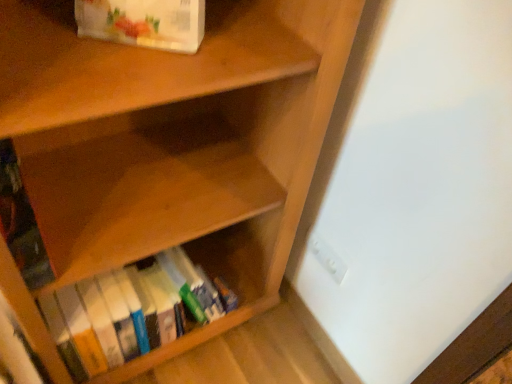
Question: From the image's perspective, is hardcover books at lower center, arranged as the first book when ordered from the bottom, beneath hardcover book at left, positioned as the 2th book in top-to-bottom order?

Choices:
 (A) yes
 (B) no

Answer: (A)

Question: Are hardcover books at lower center, arranged as the third book when viewed from the top, and hardcover book at left, the second book ordered from the bottom, located far from each other?

Choices:
 (A) yes
 (B) no

Answer: (B)

Question: From a real-world perspective, is hardcover books at lower center, arranged as the first book when ordered from the bottom, positioned under hardcover book at left, the second book ordered from the bottom, based on gravity?

Choices:
 (A) no
 (B) yes

Answer: (B)

Question: Is the position of hardcover books at lower center, arranged as the first book when ordered from the bottom, less distant than that of hardcover book at left, the second book ordered from the bottom?

Choices:
 (A) no
 (B) yes

Answer: (A)

Question: Can you confirm if hardcover books at lower center, arranged as the third book when viewed from the top, is positioned to the right of hardcover book at left, positioned as the 2th book in top-to-bottom order?

Choices:
 (A) yes
 (B) no

Answer: (A)

Question: In terms of size, does white paper bag at upper left, which is the first book in top-to-bottom order, appear bigger or smaller than hardcover books at lower center, arranged as the third book when viewed from the top?

Choices:
 (A) big
 (B) small

Answer: (B)

Question: From the image's perspective, is white paper bag at upper left, which is the first book in top-to-bottom order, positioned above or below hardcover books at lower center, arranged as the first book when ordered from the bottom?

Choices:
 (A) below
 (B) above

Answer: (B)

Question: Does point (165, 1) appear closer or farther from the camera than point (120, 309)?

Choices:
 (A) closer
 (B) farther

Answer: (A)

Question: In terms of width, does white paper bag at upper left, which is the first book in top-to-bottom order, look wider or thinner when compared to hardcover books at lower center, arranged as the third book when viewed from the top?

Choices:
 (A) wide
 (B) thin

Answer: (B)

Question: Considering the relative positions of white plastic electric outlet at lower right and white paper bag at upper left, which is the first book in top-to-bottom order, in the image provided, is white plastic electric outlet at lower right to the left or to the right of white paper bag at upper left, which is the first book in top-to-bottom order,?

Choices:
 (A) right
 (B) left

Answer: (A)

Question: Is white plastic electric outlet at lower right bigger or smaller than white paper bag at upper left, which is the first book in top-to-bottom order?

Choices:
 (A) small
 (B) big

Answer: (A)

Question: From the image's perspective, is white plastic electric outlet at lower right positioned above or below white paper bag at upper left, acting as the 3th book starting from the bottom?

Choices:
 (A) above
 (B) below

Answer: (B)

Question: In terms of width, does white plastic electric outlet at lower right look wider or thinner when compared to white paper bag at upper left, acting as the 3th book starting from the bottom?

Choices:
 (A) wide
 (B) thin

Answer: (B)

Question: From a real-world perspective, is white paper bag at upper left, which is the first book in top-to-bottom order, physically located above or below hardcover book at left, the second book ordered from the bottom?

Choices:
 (A) below
 (B) above

Answer: (B)

Question: In the image, is white paper bag at upper left, acting as the 3th book starting from the bottom, on the left side or the right side of hardcover book at left, positioned as the 2th book in top-to-bottom order?

Choices:
 (A) right
 (B) left

Answer: (A)